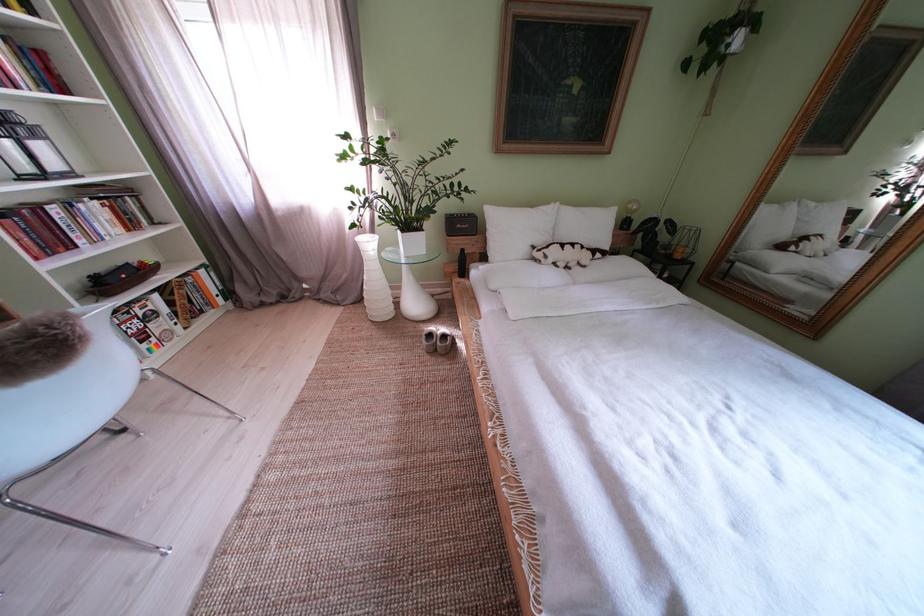
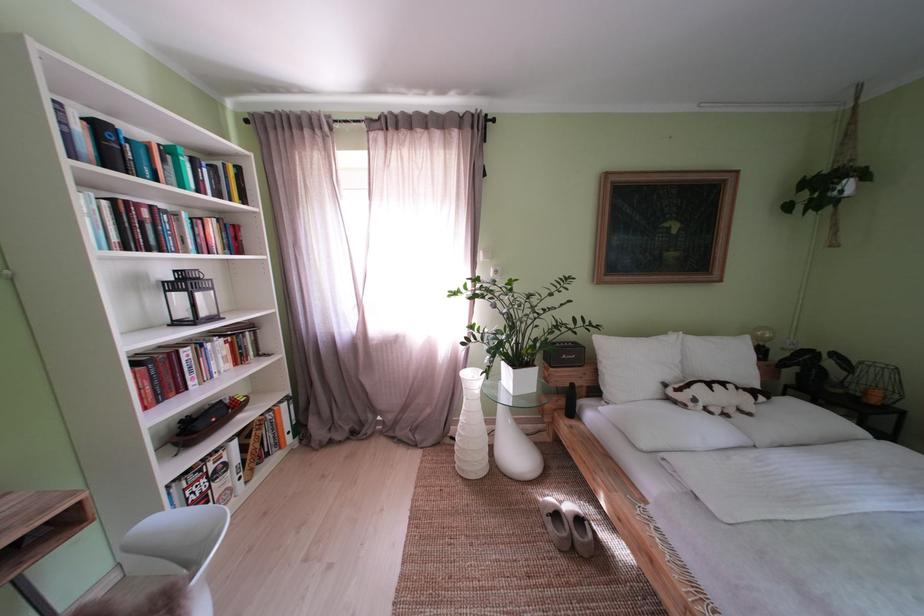
Find the pixel in the second image that matches the point at 103,299 in the first image.

(187, 450)